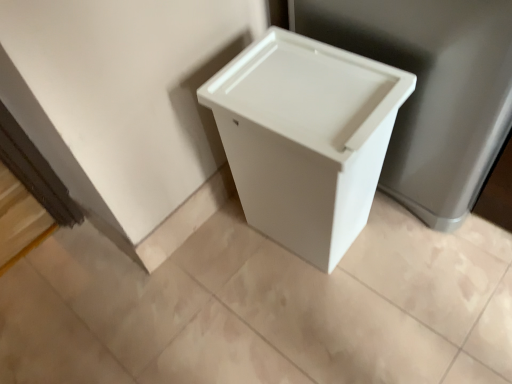
The height and width of the screenshot is (384, 512). What are the coordinates of `free space on the front side of white plastic waste container at center` in the screenshot? It's located at (331, 317).